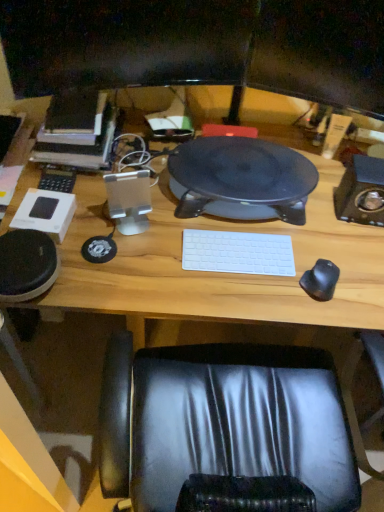
Consider the image. Measure the distance between point [70,152] and camera.

1.19 meters.

What are the coordinates of `matte black monitor at upper center, marked as the 2th computer monitor in a left-to-right arrangement` in the screenshot? It's located at (320, 52).

The width and height of the screenshot is (384, 512). What do you see at coordinates (124, 42) in the screenshot? I see `black glossy monitor at upper center, acting as the 1th computer monitor starting from the left` at bounding box center [124, 42].

Describe the element at coordinates (221, 274) in the screenshot. The height and width of the screenshot is (512, 384). I see `wooden computer desk at center` at that location.

This screenshot has width=384, height=512. I want to click on white matte keyboard at center, so click(237, 253).

The image size is (384, 512). Identify the location of black rubber mouse at right. (320, 280).

Is black rubber mouse at right next to black glossy monitor at upper center, marked as the second computer monitor in a right-to-left arrangement, and touching it?

black rubber mouse at right and black glossy monitor at upper center, marked as the second computer monitor in a right-to-left arrangement, are not in contact.

Is point (327, 271) closer or farther from the camera than point (35, 64)?

Point (327, 271).

Is black glossy monitor at upper center, marked as the second computer monitor in a right-to-left arrangement, located within black rubber mouse at right?

No, black glossy monitor at upper center, marked as the second computer monitor in a right-to-left arrangement, is located outside of black rubber mouse at right.

What are the coordinates of `the 1st computer monitor located above the black rubber mouse at right (from a real-world perspective)` in the screenshot? It's located at (124, 42).

Does point (23, 47) lie in front of point (100, 126)?

Yes, it is.

Is there a large distance between black glossy monitor at upper center, acting as the 1th computer monitor starting from the left, and hardcover book at left?

They are positioned close to each other.

Identify the location of the 1st computer monitor located above the hardcover book at left (from a real-world perspective). This screenshot has height=512, width=384. (124, 42).

Is black glossy monitor at upper center, marked as the second computer monitor in a right-to-left arrangement, shorter than hardcover book at left?

Incorrect, the height of black glossy monitor at upper center, marked as the second computer monitor in a right-to-left arrangement, does not fall short of that of hardcover book at left.

Between wooden computer desk at center and hardcover book at left, which one has larger size?

Bigger between the two is wooden computer desk at center.

From a real-world perspective, is wooden computer desk at center under hardcover book at left?

Yes, from a real-world perspective, wooden computer desk at center is under hardcover book at left.

Considering the positions of points (104, 309) and (93, 114), is point (104, 309) farther from camera compared to point (93, 114)?

No, it is not.

Is hardcover book at left at the back of wooden computer desk at center?

No, wooden computer desk at center's orientation is not away from hardcover book at left.

Does matte black monitor at upper center, which ranks as the first computer monitor in right-to-left order, come in front of black rubber mouse at right?

Yes.

Considering the relative sizes of matte black monitor at upper center, marked as the 2th computer monitor in a left-to-right arrangement, and black rubber mouse at right in the image provided, is matte black monitor at upper center, marked as the 2th computer monitor in a left-to-right arrangement, thinner than black rubber mouse at right?

Correct, the width of matte black monitor at upper center, marked as the 2th computer monitor in a left-to-right arrangement, is less than that of black rubber mouse at right.

Is matte black monitor at upper center, marked as the 2th computer monitor in a left-to-right arrangement, completely or partially outside of black rubber mouse at right?

Yes, matte black monitor at upper center, marked as the 2th computer monitor in a left-to-right arrangement, is located beyond the bounds of black rubber mouse at right.

Considering the sizes of objects matte black monitor at upper center, marked as the 2th computer monitor in a left-to-right arrangement, and black rubber mouse at right in the image provided, who is bigger, matte black monitor at upper center, marked as the 2th computer monitor in a left-to-right arrangement, or black rubber mouse at right?

Bigger between the two is matte black monitor at upper center, marked as the 2th computer monitor in a left-to-right arrangement.

Is black rubber mouse at right in contact with matte black monitor at upper center, marked as the 2th computer monitor in a left-to-right arrangement?

black rubber mouse at right and matte black monitor at upper center, marked as the 2th computer monitor in a left-to-right arrangement, are clearly separated.

Which is behind, point (324, 290) or point (363, 65)?

The point (363, 65) is farther from the camera.

Does black rubber mouse at right appear on the right side of matte black monitor at upper center, marked as the 2th computer monitor in a left-to-right arrangement?

No, black rubber mouse at right is not to the right of matte black monitor at upper center, marked as the 2th computer monitor in a left-to-right arrangement.

Based on the photo, which object is positioned more to the right, hardcover book at left or black rubber mouse at right?

From the viewer's perspective, black rubber mouse at right appears more on the right side.

Consider the image. Is the depth of hardcover book at left greater than that of black rubber mouse at right?

Yes, it is.

Is hardcover book at left placed right next to black rubber mouse at right?

hardcover book at left and black rubber mouse at right are clearly separated.

Between point (49, 298) and point (327, 54), which one is positioned in front?

The point (49, 298) is closer.

Is wooden computer desk at center not close to matte black monitor at upper center, marked as the 2th computer monitor in a left-to-right arrangement?

wooden computer desk at center is actually quite close to matte black monitor at upper center, marked as the 2th computer monitor in a left-to-right arrangement.

Is wooden computer desk at center inside the boundaries of matte black monitor at upper center, marked as the 2th computer monitor in a left-to-right arrangement, or outside?

wooden computer desk at center is outside matte black monitor at upper center, marked as the 2th computer monitor in a left-to-right arrangement.

Locate an element on the screen. Image resolution: width=384 pixels, height=512 pixels. computer monitor on the left of black rubber mouse at right is located at coordinates (124, 42).

Identify the location of the 2nd computer monitor in front of the hardcover book at left, starting your count from the anchor. (124, 42).

Which object lies nearer to the anchor point black rubber mouse at right, matte black monitor at upper center, which ranks as the first computer monitor in right-to-left order, or hardcover book at left?

matte black monitor at upper center, which ranks as the first computer monitor in right-to-left order, lies closer to black rubber mouse at right than the other object.

Considering their positions, is matte black monitor at upper center, marked as the 2th computer monitor in a left-to-right arrangement, positioned closer to black glossy monitor at upper center, marked as the second computer monitor in a right-to-left arrangement, than black plastic speaker at center?

matte black monitor at upper center, marked as the 2th computer monitor in a left-to-right arrangement, lies closer to black glossy monitor at upper center, marked as the second computer monitor in a right-to-left arrangement, than the other object.

From the image, which object appears to be nearer to wooden computer desk at center, matte black monitor at upper center, marked as the 2th computer monitor in a left-to-right arrangement, or black glossy monitor at upper center, acting as the 1th computer monitor starting from the left?

Among the two, matte black monitor at upper center, marked as the 2th computer monitor in a left-to-right arrangement, is located nearer to wooden computer desk at center.

Estimate the real-world distances between objects in this image. Which object is further from matte black monitor at upper center, marked as the 2th computer monitor in a left-to-right arrangement, black rubber mouse at right or black plastic speaker at center?

black rubber mouse at right is further to matte black monitor at upper center, marked as the 2th computer monitor in a left-to-right arrangement.

From the image, which object appears to be nearer to black plastic speaker at center, matte black monitor at upper center, which ranks as the first computer monitor in right-to-left order, or white matte keyboard at center?

white matte keyboard at center is closer to black plastic speaker at center.

When comparing their distances from black plastic speaker at center, does black glossy monitor at upper center, acting as the 1th computer monitor starting from the left, or black rubber mouse at right seem closer?

black glossy monitor at upper center, acting as the 1th computer monitor starting from the left.

Looking at this image, when comparing their distances from black rubber mouse at right, does matte black monitor at upper center, which ranks as the first computer monitor in right-to-left order, or black glossy monitor at upper center, marked as the second computer monitor in a right-to-left arrangement, seem further?

black glossy monitor at upper center, marked as the second computer monitor in a right-to-left arrangement.

Based on the photo, considering their positions, is wooden computer desk at center positioned closer to black rubber mouse at right than black glossy monitor at upper center, marked as the second computer monitor in a right-to-left arrangement?

Among the two, wooden computer desk at center is located nearer to black rubber mouse at right.

At what (x,y) coordinates should I click in order to perform the action: click on laptop keyboard between black glossy monitor at upper center, marked as the second computer monitor in a right-to-left arrangement, and wooden computer desk at center vertically. Please return your answer as a coordinate pair (x, y). This screenshot has height=512, width=384. Looking at the image, I should click on (237, 253).

Where is `computer monitor between black glossy monitor at upper center, marked as the second computer monitor in a right-to-left arrangement, and wooden computer desk at center vertically`? Image resolution: width=384 pixels, height=512 pixels. computer monitor between black glossy monitor at upper center, marked as the second computer monitor in a right-to-left arrangement, and wooden computer desk at center vertically is located at coordinates (320, 52).

The height and width of the screenshot is (512, 384). Find the location of `mouse between black glossy monitor at upper center, marked as the second computer monitor in a right-to-left arrangement, and wooden computer desk at center vertically`. mouse between black glossy monitor at upper center, marked as the second computer monitor in a right-to-left arrangement, and wooden computer desk at center vertically is located at coordinates [320, 280].

Locate an element on the screen. The image size is (384, 512). stereo between hardcover book at left and wooden computer desk at center in the horizontal direction is located at coordinates (240, 179).